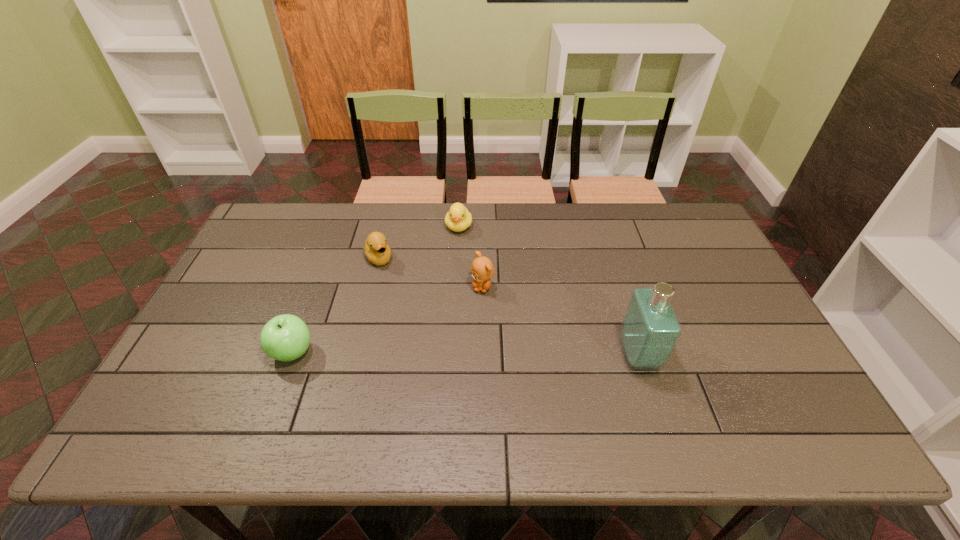
Locate an element on the screen. The image size is (960, 540). vacant area between the rightmost object and the farthest object is located at coordinates (548, 291).

Locate an element on the screen. The image size is (960, 540). vacant area between the apple and the fourth object from right to left is located at coordinates (335, 305).

I want to click on vacant area that lies between the right duckling and the left duckling, so click(419, 242).

Identify the location of free space between the teddy bear and the fourth nearest object. (430, 273).

This screenshot has width=960, height=540. What are the coordinates of `free space between the tallest object and the teddy bear` in the screenshot? It's located at (561, 321).

This screenshot has height=540, width=960. Find the location of `vacant space that is in between the second farthest object and the tallest object`. vacant space that is in between the second farthest object and the tallest object is located at coordinates (509, 307).

Locate an element on the screen. This screenshot has height=540, width=960. vacant point located between the apple and the fourth object from right to left is located at coordinates (335, 305).

Image resolution: width=960 pixels, height=540 pixels. I want to click on object that is the closest to the farther duckling, so click(x=378, y=252).

You are a GUI agent. You are given a task and a screenshot of the screen. Output one action in this format:
    pyautogui.click(x=<x>, y=<y>)
    Task: Click on the object that is the closest one to the farthest object
    The width and height of the screenshot is (960, 540).
    Given the screenshot: What is the action you would take?
    pyautogui.click(x=378, y=252)

The image size is (960, 540). I want to click on free space that satisfies the following two spatial constraints: 1. on the front side of the right duckling; 2. on the front label of the tallest object, so click(x=451, y=355).